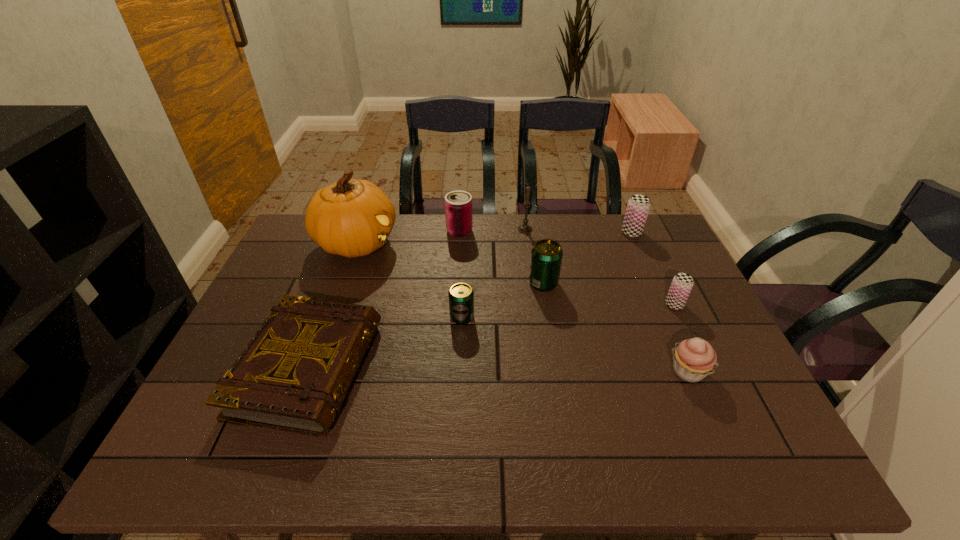
The width and height of the screenshot is (960, 540). Find the location of `vacant space that satisfies the following two spatial constraints: 1. on the back side of the bigger purple beer can; 2. on the left side of the cupcake`. vacant space that satisfies the following two spatial constraints: 1. on the back side of the bigger purple beer can; 2. on the left side of the cupcake is located at coordinates 628,233.

Identify the location of free spot that satisfies the following two spatial constraints: 1. on the back side of the farther green beer can; 2. on the left side of the smaller green beer can. (464, 283).